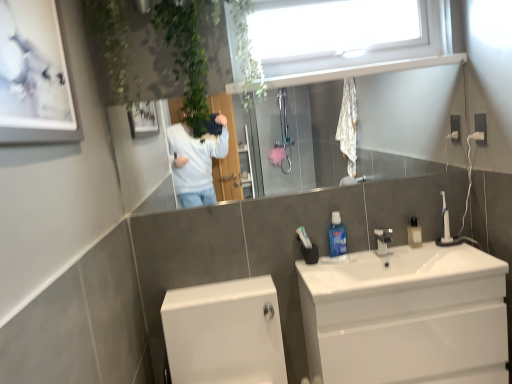
Identify the location of spots to the right of blue plastic mouthwash at center, positioned as the first mouthwash in left-to-right order. (367, 249).